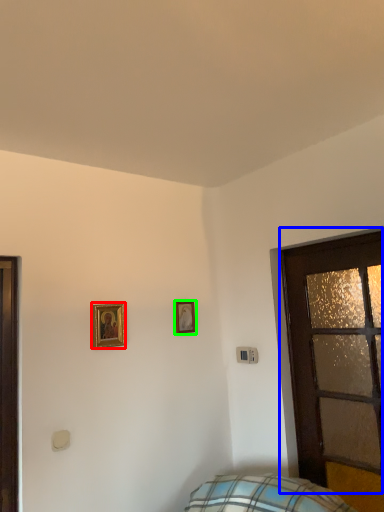
Question: Considering the real-world distances, which object is closest to picture frame (highlighted by a red box)? door (highlighted by a blue box) or picture frame (highlighted by a green box).

Choices:
 (A) door
 (B) picture frame

Answer: (B)